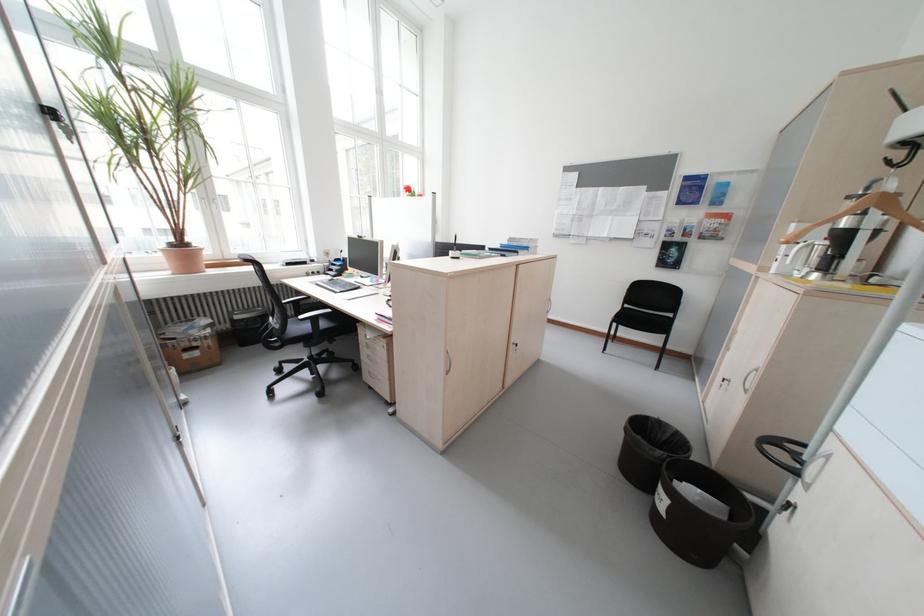
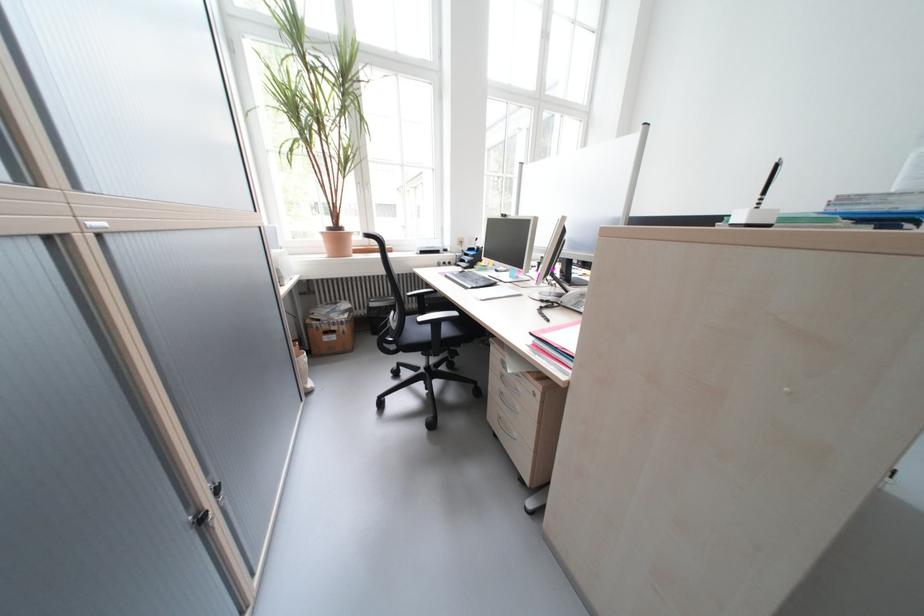
Locate, in the second image, the point that corresponds to pixel 311 318 in the first image.

(431, 320)